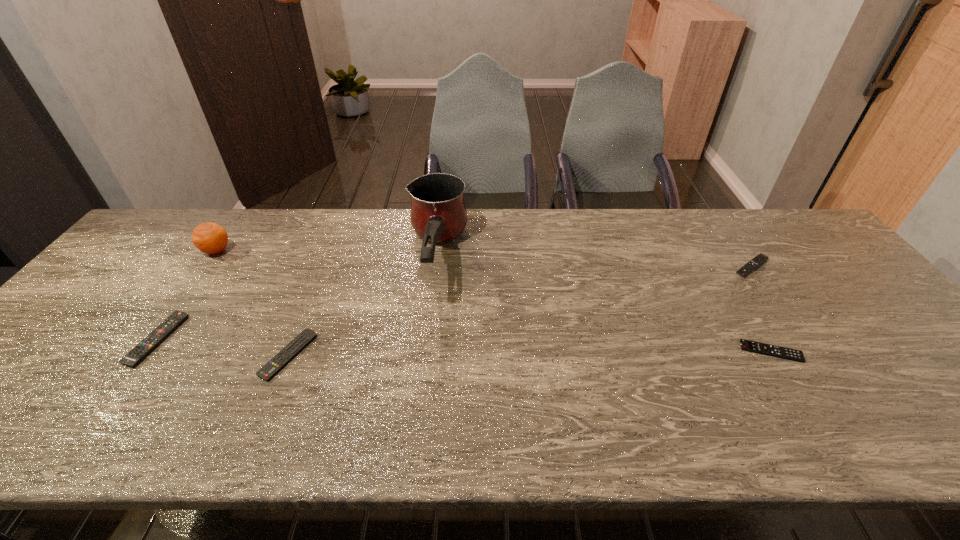
At what (x,y) coordinates should I click in order to perform the action: click on vacant area that lies between the shortest remote control and the leftmost remote control. Please return your answer as a coordinate pair (x, y). Looking at the image, I should click on (465, 346).

This screenshot has width=960, height=540. In order to click on blank region between the fourth object from right to left and the fourth object from left to right in this screenshot , I will do click(x=362, y=307).

This screenshot has height=540, width=960. In order to click on unoccupied position between the tallest object and the shortest object in this screenshot , I will do `click(604, 305)`.

Identify the location of free spot between the leftmost remote control and the third object from left to right. (223, 347).

Locate an element on the screen. The width and height of the screenshot is (960, 540). free spot between the fourth object from left to right and the farthest remote control is located at coordinates tap(593, 262).

Where is `unoccupied area between the third object from right to left and the third remote control from right to left`? unoccupied area between the third object from right to left and the third remote control from right to left is located at coordinates (362, 307).

You are a GUI agent. You are given a task and a screenshot of the screen. Output one action in this format:
    pyautogui.click(x=<x>, y=<y>)
    Task: Click on the free space between the shortest remote control and the fifth shortest object
    
    Given the screenshot: What is the action you would take?
    tap(494, 301)

Locate an element on the screen. The height and width of the screenshot is (540, 960). vacant area that lies between the orange and the fourth object from right to left is located at coordinates (252, 303).

The height and width of the screenshot is (540, 960). I want to click on object that is the fourth nearest to the saucepan, so (x=746, y=345).

The image size is (960, 540). I want to click on object that can be found as the third closest to the farthest remote control, so click(289, 352).